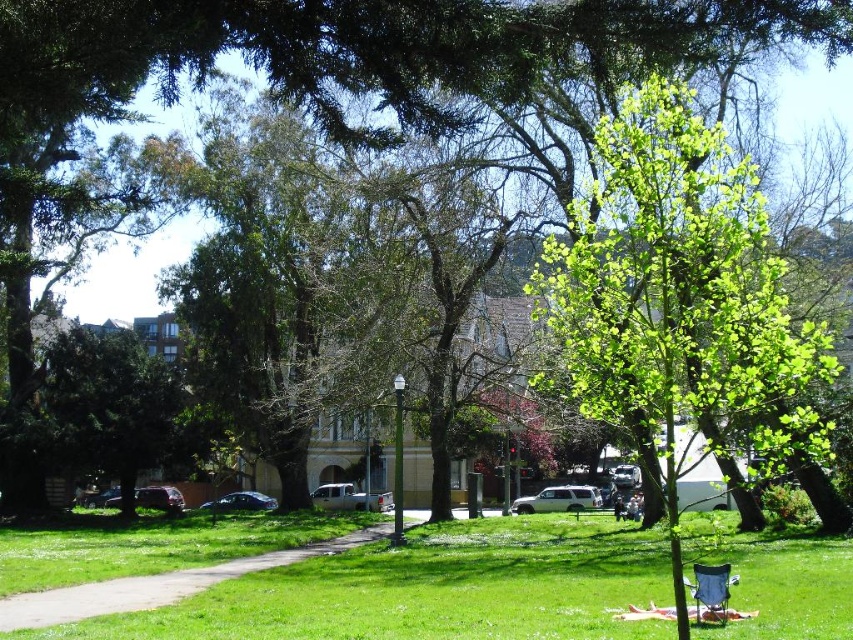
Question: Which of the following is the farthest from the observer?

Choices:
 (A) (741, 314)
 (B) (688, 582)
 (C) (186, 593)

Answer: (C)

Question: In this image, where is green grassy path at lower left located relative to blue fabric chair at lower right?

Choices:
 (A) below
 (B) above

Answer: (A)

Question: Among these points, which one is nearest to the camera?

Choices:
 (A) (727, 584)
 (B) (585, 260)

Answer: (B)

Question: Observing the image, what is the correct spatial positioning of green leafy tree at center in reference to blue fabric chair at lower right?

Choices:
 (A) left
 (B) right

Answer: (B)

Question: Is green leafy tree at center bigger than green grassy path at lower left?

Choices:
 (A) no
 (B) yes

Answer: (B)

Question: Which of the following is the farthest from the observer?

Choices:
 (A) green leafy tree at center
 (B) blue fabric chair at lower right
 (C) green grassy path at lower left

Answer: (C)